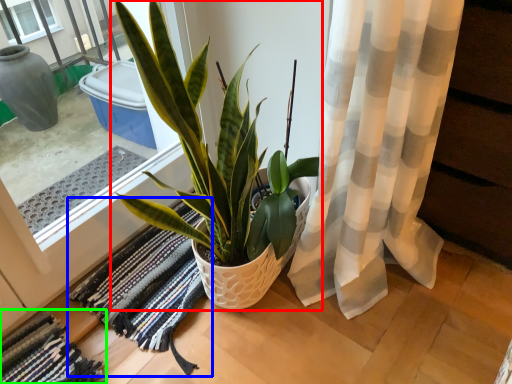
Question: Based on their relative distances, which object is farther from houseplant (highlighted by a red box)? Choose from bath mat (highlighted by a blue box) and bath mat (highlighted by a green box).

Choices:
 (A) bath mat
 (B) bath mat

Answer: (B)